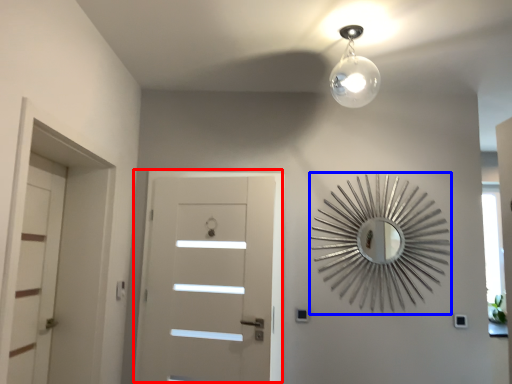
Question: Which object is closer to the camera taking this photo, door (highlighted by a red box) or design (highlighted by a blue box)?

Choices:
 (A) door
 (B) design

Answer: (A)